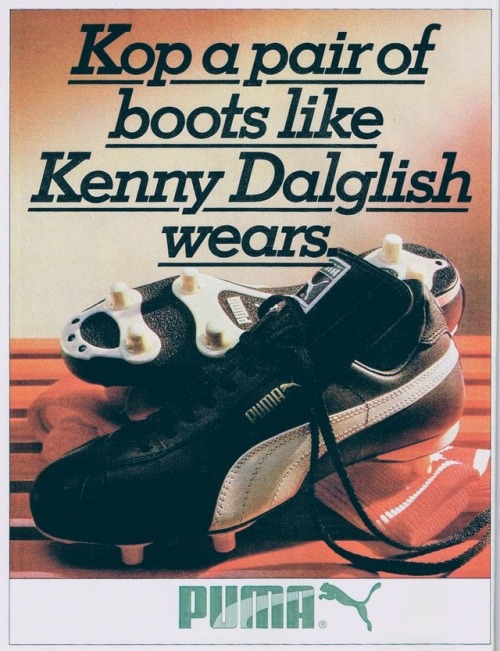
I want to click on bench, so pyautogui.click(x=23, y=462).